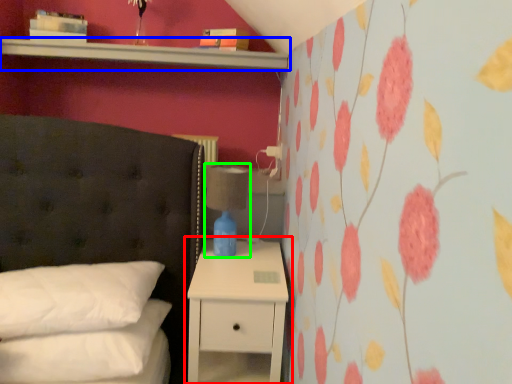
Question: Based on their relative distances, which object is nearer to nightstand (highlighted by a red box)? Choose from shelf (highlighted by a blue box) and bedside lamp (highlighted by a green box).

Choices:
 (A) shelf
 (B) bedside lamp

Answer: (B)